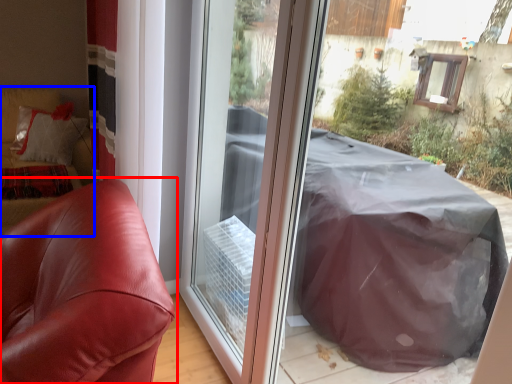
Question: Which object appears farthest to the camera in this image, furniture (highlighted by a red box) or couch (highlighted by a blue box)?

Choices:
 (A) furniture
 (B) couch

Answer: (B)